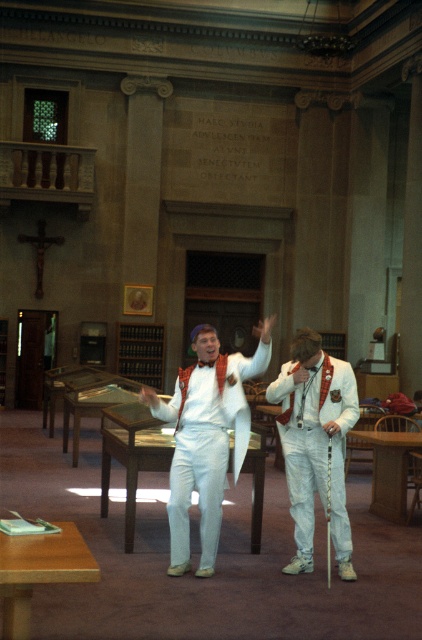
Is white cotton suit at center above wooden table at lower left?

Correct, white cotton suit at center is located above wooden table at lower left.

Can you confirm if white cotton suit at center is bigger than wooden table at lower left?

Yes.

Is point (332, 404) positioned in front of point (83, 556)?

No, (332, 404) is further to viewer.

I want to click on white cotton suit at center, so click(x=314, y=444).

Who is lower down, wooden table at lower left or light brown wooden table at center?

light brown wooden table at center

Is the position of wooden table at lower left more distant than that of light brown wooden table at center?

No, it is not.

This screenshot has height=640, width=422. What do you see at coordinates (38, 570) in the screenshot? I see `wooden table at lower left` at bounding box center [38, 570].

At what (x,y) coordinates should I click in order to perform the action: click on wooden table at lower left. Please return your answer as a coordinate pair (x, y). Looking at the image, I should click on (38, 570).

Is white cotton suit at center wider than wooden table at center?

Incorrect, white cotton suit at center's width does not surpass wooden table at center's.

The height and width of the screenshot is (640, 422). In order to click on white cotton suit at center in this screenshot , I will do `click(314, 444)`.